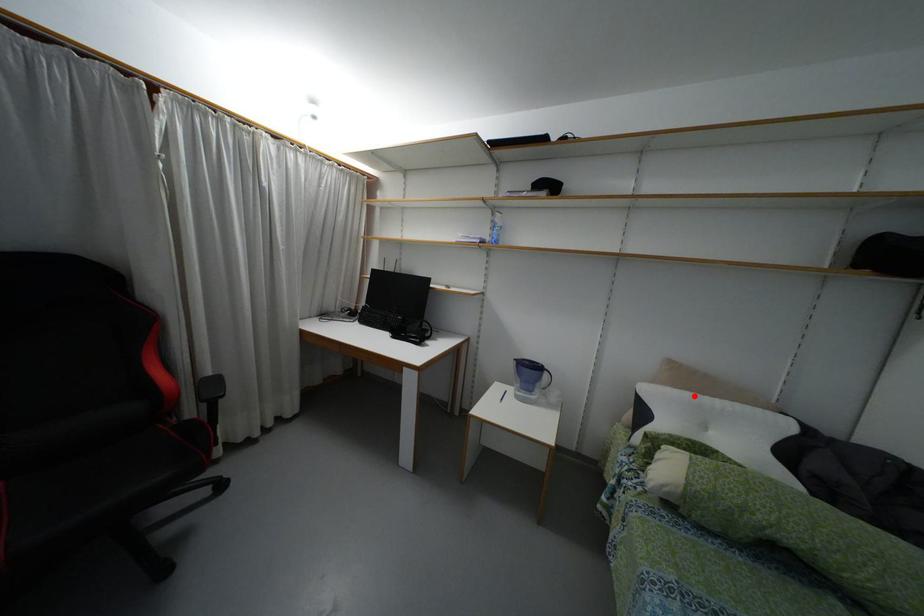
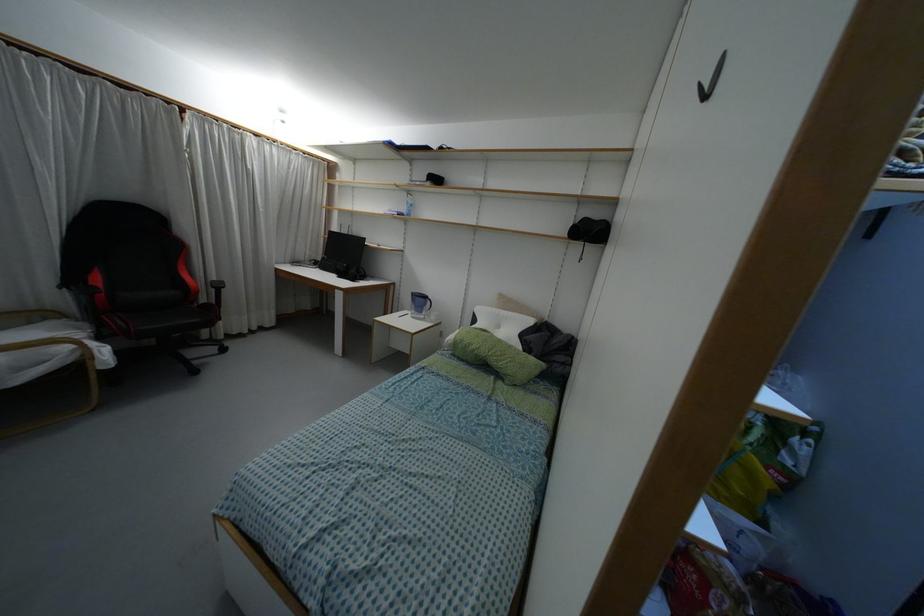
In the second image, find the point that corresponds to the highlighted location in the first image.

(496, 310)